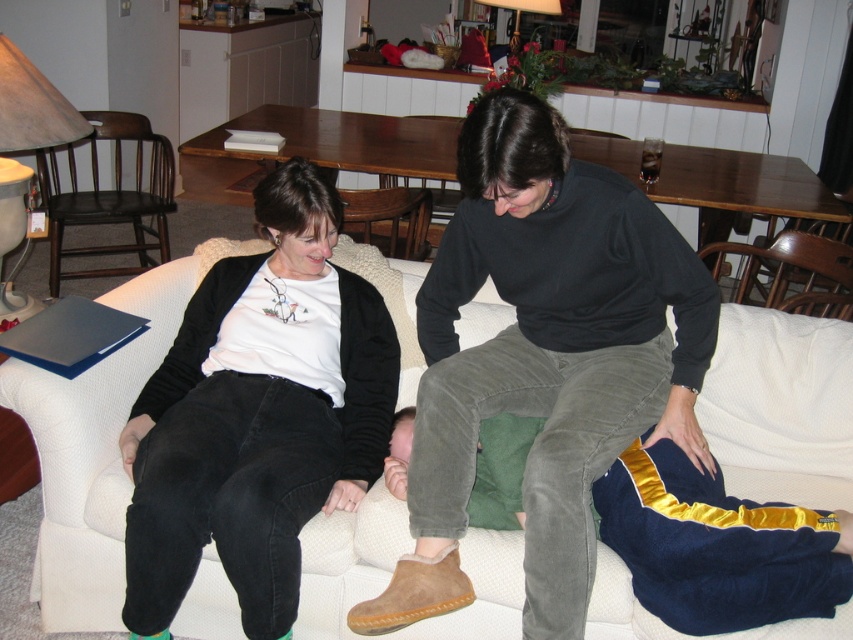
Question: Among these points, which one is nearest to the camera?

Choices:
 (A) (45, 493)
 (B) (807, 232)
 (C) (416, 218)
 (D) (136, 404)

Answer: (A)

Question: Which point appears closest to the camera in this image?

Choices:
 (A) (401, 216)
 (B) (509, 618)
 (C) (55, 122)
 (D) (840, 582)

Answer: (D)

Question: Is dark gray corduroy pants at center wider than dark brown wood chair at left?

Choices:
 (A) no
 (B) yes

Answer: (A)

Question: Estimate the real-world distances between objects in this image. Which object is farther from the white fabric armchair at center?

Choices:
 (A) white fabric couch at center
 (B) dark brown wood chair at left

Answer: (B)

Question: Is the position of navy velour pants at lower right less distant than that of brown wooden chair at right?

Choices:
 (A) no
 (B) yes

Answer: (B)

Question: Does navy velour pants at lower right appear under white fabric armchair at center?

Choices:
 (A) yes
 (B) no

Answer: (A)